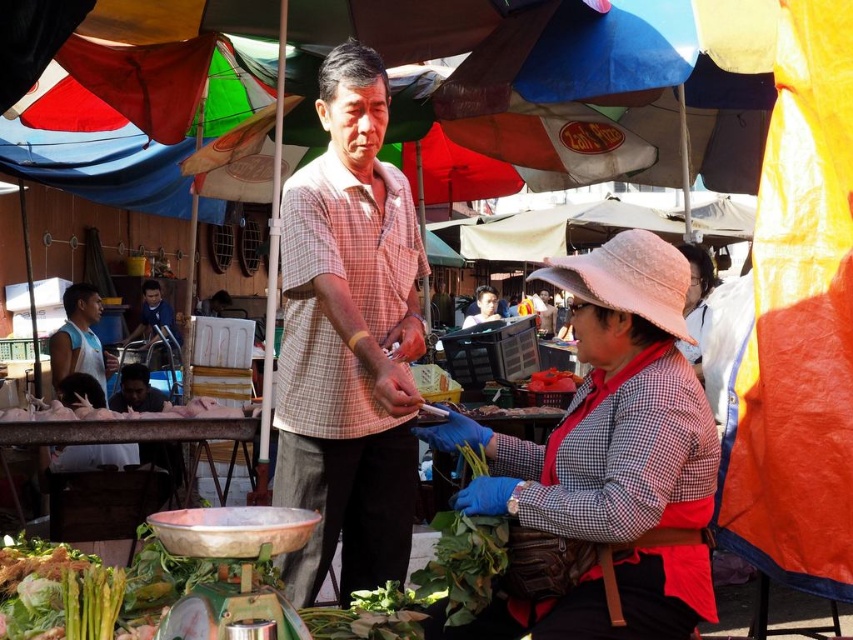
The width and height of the screenshot is (853, 640). What do you see at coordinates (347, 340) in the screenshot? I see `plaid shirt at center` at bounding box center [347, 340].

Which is behind, point (341, 496) or point (467, 324)?

The point (467, 324) is more distant.

This screenshot has height=640, width=853. I want to click on plaid shirt at center, so click(347, 340).

Does light blue sleeveless shirt at left have a greater width compared to smooth brown shirt at center?

Correct, the width of light blue sleeveless shirt at left exceeds that of smooth brown shirt at center.

Can you confirm if light blue sleeveless shirt at left is taller than smooth brown shirt at center?

Yes.

Measure the distance between light blue sleeveless shirt at left and camera.

A distance of 18.17 feet exists between light blue sleeveless shirt at left and camera.

Identify the location of light blue sleeveless shirt at left. The image size is (853, 640). (79, 339).

Who is more distant from viewer, (407, 369) or (140, 348)?

The point (140, 348) is behind.

Can you confirm if plaid shirt at center is positioned below blue shirt at center?

Yes, plaid shirt at center is below blue shirt at center.

The height and width of the screenshot is (640, 853). Identify the location of plaid shirt at center. (347, 340).